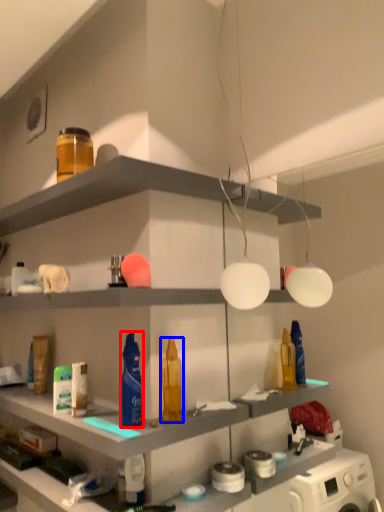
Question: Which object appears farthest to the camera in this image, cleaning product (highlighted by a red box) or toiletry (highlighted by a blue box)?

Choices:
 (A) cleaning product
 (B) toiletry

Answer: (B)